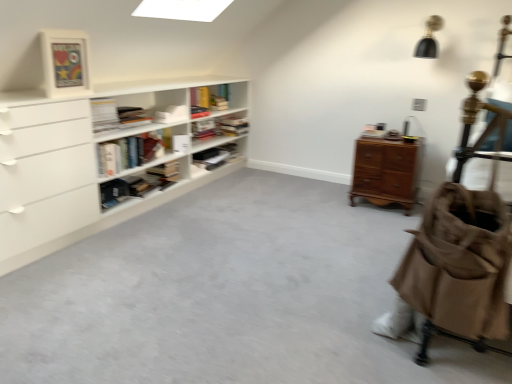
Question: Should I look upward or downward to see brown canvas stroller at right?

Choices:
 (A) down
 (B) up

Answer: (A)

Question: Is brown canvas stroller at right further to camera compared to white matte bookshelf at upper center, positioned as the third book in bottom-to-top order?

Choices:
 (A) yes
 (B) no

Answer: (B)

Question: Is brown canvas stroller at right bigger than white matte bookshelf at upper center, the 2th book when ordered from top to bottom?

Choices:
 (A) yes
 (B) no

Answer: (A)

Question: Is the position of brown canvas stroller at right less distant than that of white matte bookshelf at upper center, positioned as the third book in bottom-to-top order?

Choices:
 (A) yes
 (B) no

Answer: (A)

Question: Does brown canvas stroller at right have a greater width compared to white matte bookshelf at upper center, the 2th book when ordered from top to bottom?

Choices:
 (A) no
 (B) yes

Answer: (B)

Question: From the image's perspective, is brown canvas stroller at right on top of white matte bookshelf at upper center, the 2th book when ordered from top to bottom?

Choices:
 (A) no
 (B) yes

Answer: (A)

Question: Is brown canvas stroller at right outside of white matte bookshelf at upper center, the 2th book when ordered from top to bottom?

Choices:
 (A) no
 (B) yes

Answer: (B)

Question: Can you confirm if matte black bookshelf at center, acting as the 2th shelf starting from the back, is positioned to the right of white matte bookshelf at left, the 1th shelf viewed from the front?

Choices:
 (A) yes
 (B) no

Answer: (A)

Question: Is matte black bookshelf at center, acting as the 2th shelf starting from the back, aimed at white matte bookshelf at left, which appears as the third shelf when viewed from the back?

Choices:
 (A) no
 (B) yes

Answer: (B)

Question: From the image's perspective, is matte black bookshelf at center, acting as the 2th shelf starting from the back, below white matte bookshelf at left, which appears as the third shelf when viewed from the back?

Choices:
 (A) no
 (B) yes

Answer: (B)

Question: From a real-world perspective, is matte black bookshelf at center, the second shelf when ordered from front to back, located higher than white matte bookshelf at left, which appears as the third shelf when viewed from the back?

Choices:
 (A) yes
 (B) no

Answer: (B)

Question: Does matte black bookshelf at center, acting as the 2th shelf starting from the back, have a lesser width compared to white matte bookshelf at left, which appears as the third shelf when viewed from the back?

Choices:
 (A) yes
 (B) no

Answer: (A)

Question: Is matte black bookshelf at center, the second shelf when ordered from front to back, not close to white matte bookshelf at left, the 1th shelf viewed from the front?

Choices:
 (A) no
 (B) yes

Answer: (A)

Question: Can you confirm if matte black bookshelf at center, acting as the 2th shelf starting from the back, is taller than light brown wooden chest of drawers at right?

Choices:
 (A) yes
 (B) no

Answer: (B)